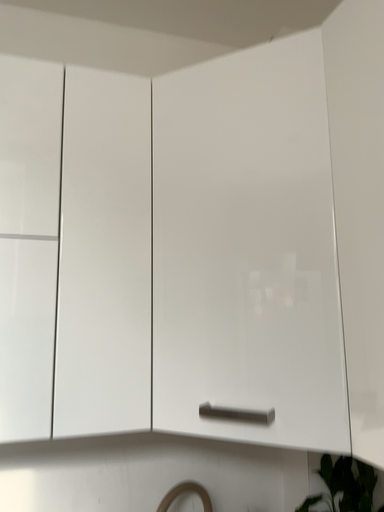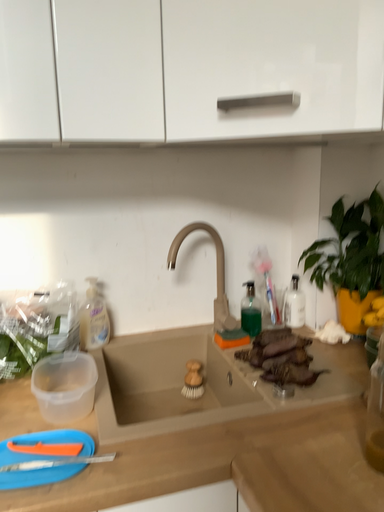
Question: How did the camera likely rotate when shooting the video?

Choices:
 (A) rotated downward
 (B) rotated upward

Answer: (A)